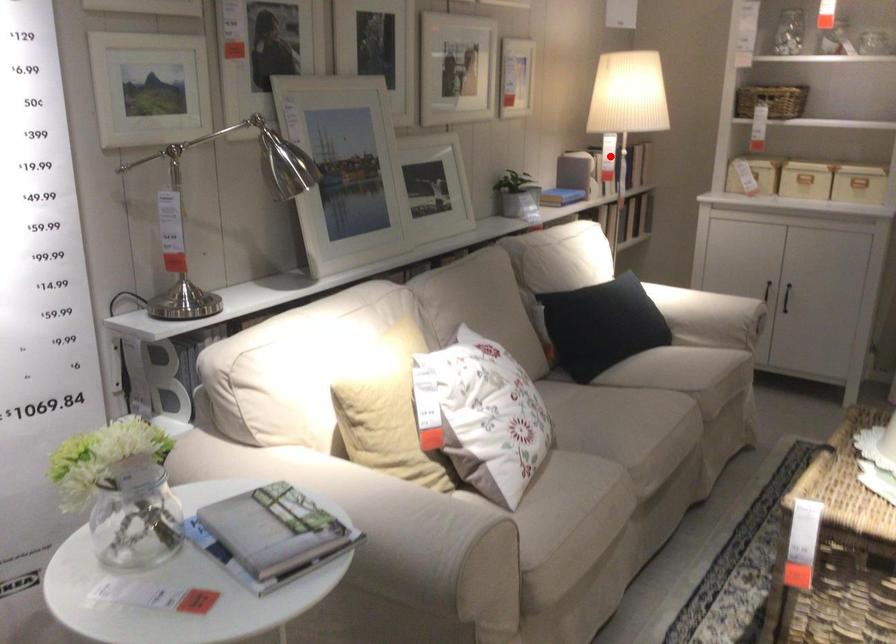
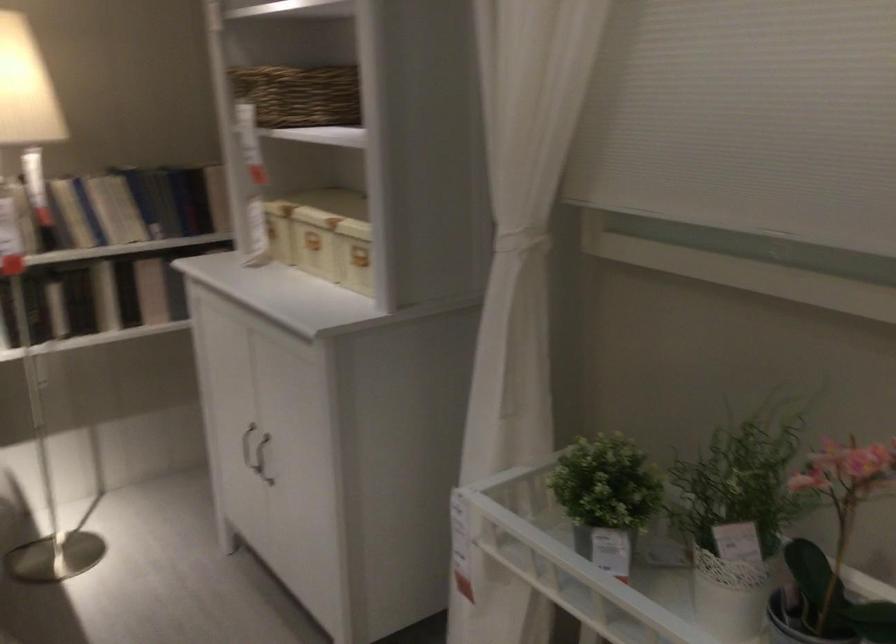
Locate, in the second image, the point that corresponds to the highlighted location in the first image.

(71, 213)